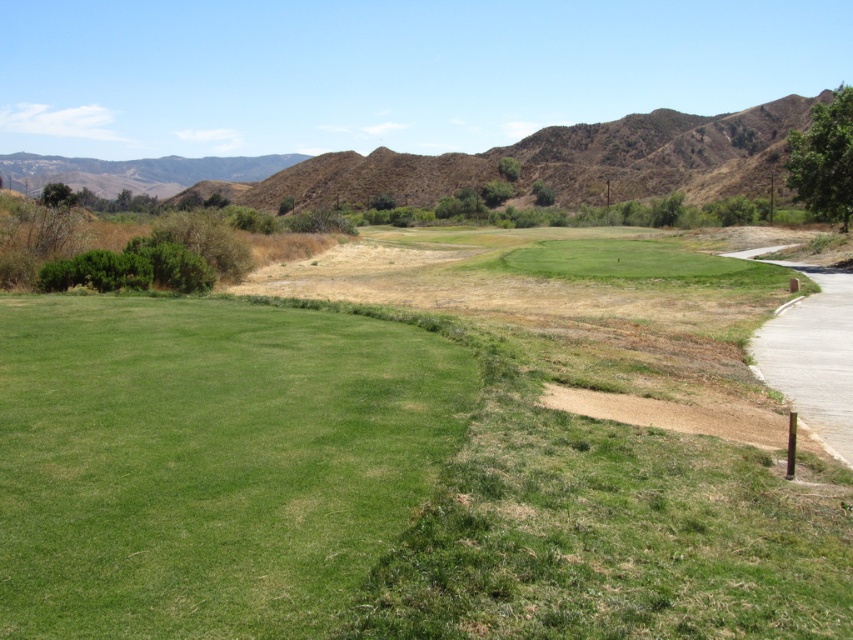
Is green grass at center shorter than brown/dry grassy hill at upper center?

Yes.

The image size is (853, 640). I want to click on green grass at center, so [x=207, y=461].

Measure the distance from green grassy golf course at center to brown/dry grassy hill at upper center.

619.36 feet

Is point (271, 486) farther from camera compared to point (44, 157)?

No, it is not.

Where is `green grassy golf course at center`? green grassy golf course at center is located at coordinates (416, 451).

Between point (421, 248) and point (170, 344), which one is positioned in front?

Positioned in front is point (170, 344).

Which of these two, green grassy golf course at center or green grass at center, stands taller?

Standing taller between the two is green grassy golf course at center.

Measure the distance between point (74,582) and camera.

5.03 meters

Find the location of a particular element. This screenshot has width=853, height=640. green grassy golf course at center is located at coordinates (416, 451).